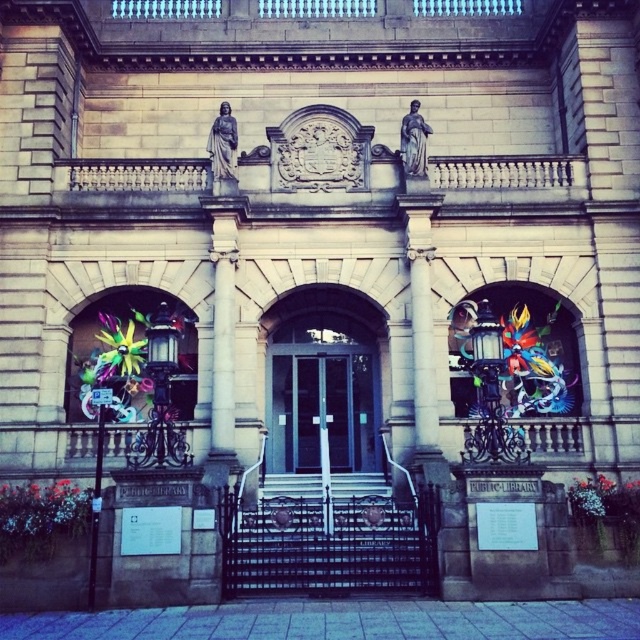
You are standing at the entrance of the grand public library and want to take a photo of the white marble pillar at center. If your camera can only focus on objects within a 0.5 unit radius centered at point 0.5, 0.5, will the pillar be in focus?

The white marble pillar at center is located at point (221, 353). The distance between this point and the camera focus center at (320, 320) is sqrt of squared differences. Calculating sqrt of squared differences between 0.552 and 0.5 in x and 0.348 and 0.5 in y. The squared differences are 0.0002704 and 0.022864. Sum is 0.0231344. Square root is approximately 0.152 units. Since 0.152 is less than 0.5, the pillar will be within the focus range and thus in focus.